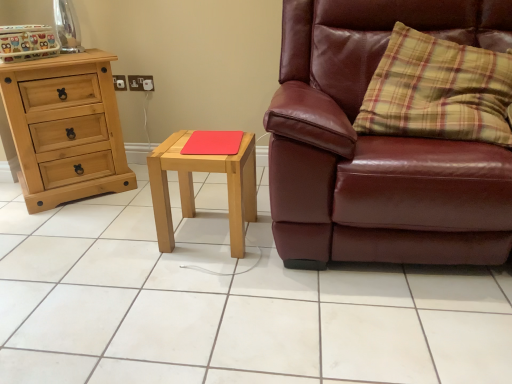
Question: Is white glossy tile at center to the left of light wood/matte nightstand at center from the viewer's perspective?

Choices:
 (A) no
 (B) yes

Answer: (B)

Question: Is white glossy tile at center aimed at light wood/matte nightstand at center?

Choices:
 (A) yes
 (B) no

Answer: (B)

Question: Is white glossy tile at center taller than light wood/matte nightstand at center?

Choices:
 (A) yes
 (B) no

Answer: (B)

Question: Is white glossy tile at center wider than light wood/matte nightstand at center?

Choices:
 (A) no
 (B) yes

Answer: (B)

Question: Is white glossy tile at center oriented away from light wood/matte nightstand at center?

Choices:
 (A) no
 (B) yes

Answer: (A)

Question: Is natural wood chest of drawers at left wider or thinner than red matte mousepad at center?

Choices:
 (A) thin
 (B) wide

Answer: (B)

Question: Looking at the image, does natural wood chest of drawers at left seem bigger or smaller compared to red matte mousepad at center?

Choices:
 (A) small
 (B) big

Answer: (B)

Question: In terms of height, does natural wood chest of drawers at left look taller or shorter compared to red matte mousepad at center?

Choices:
 (A) tall
 (B) short

Answer: (A)

Question: From a real-world perspective, is natural wood chest of drawers at left physically located above or below red matte mousepad at center?

Choices:
 (A) below
 (B) above

Answer: (A)

Question: Is yellow plaid pillow at right situated inside red matte mousepad at center or outside?

Choices:
 (A) inside
 (B) outside

Answer: (B)

Question: From the image's perspective, relative to red matte mousepad at center, is yellow plaid pillow at right above or below?

Choices:
 (A) below
 (B) above

Answer: (B)

Question: Considering the positions of yellow plaid pillow at right and red matte mousepad at center in the image, is yellow plaid pillow at right taller or shorter than red matte mousepad at center?

Choices:
 (A) tall
 (B) short

Answer: (A)

Question: Based on their sizes in the image, would you say yellow plaid pillow at right is bigger or smaller than red matte mousepad at center?

Choices:
 (A) small
 (B) big

Answer: (B)

Question: From the image's perspective, is yellow plaid pillow at right located above or below leather couch at right?

Choices:
 (A) below
 (B) above

Answer: (B)

Question: Looking at their shapes, would you say yellow plaid pillow at right is wider or thinner than leather couch at right?

Choices:
 (A) thin
 (B) wide

Answer: (A)